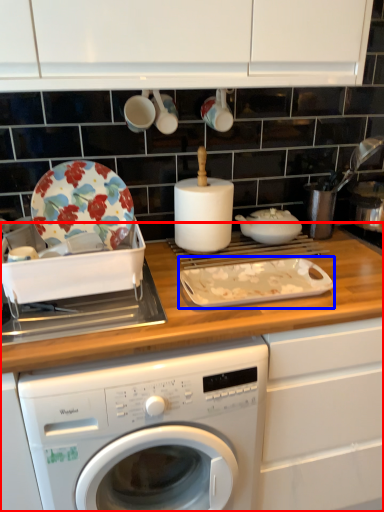
Question: Which point is further to the camera, countertop (highlighted by a red box) or baking sheet (highlighted by a blue box)?

Choices:
 (A) countertop
 (B) baking sheet

Answer: (B)